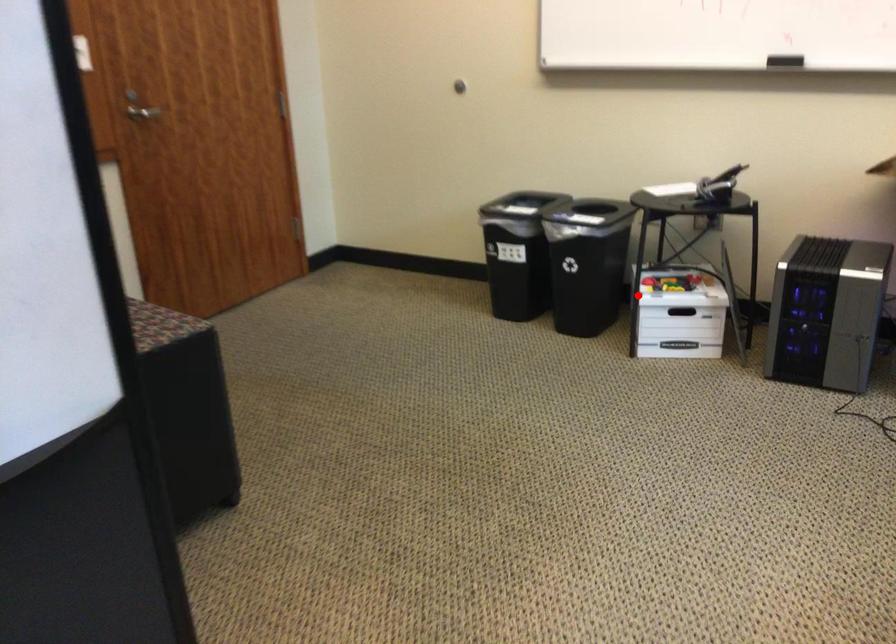
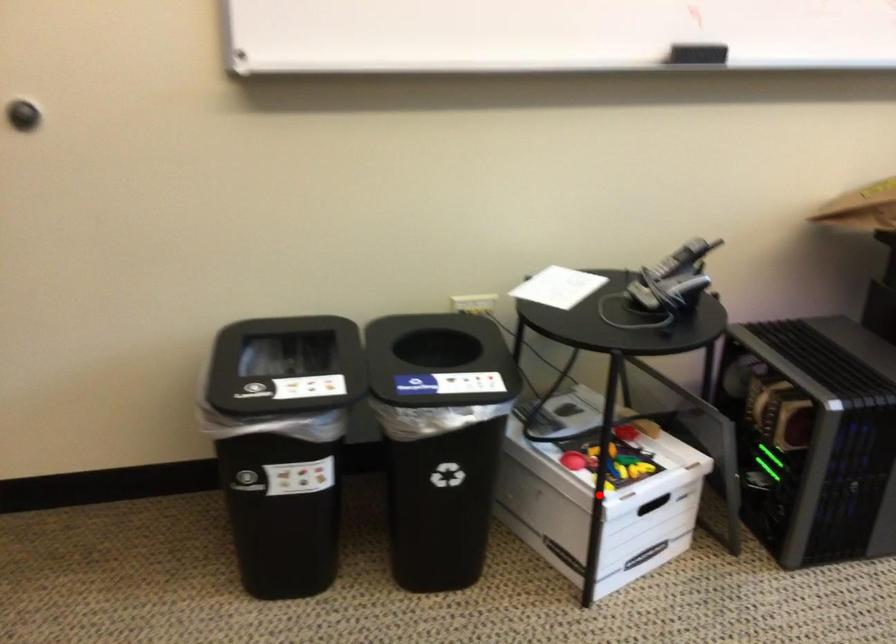
I am providing you with two images of the same scene from different viewpoints. A red point is marked on the first image and another point is marked on the second image. Is the red point in image1 aligned with the point shown in image2?

Yes